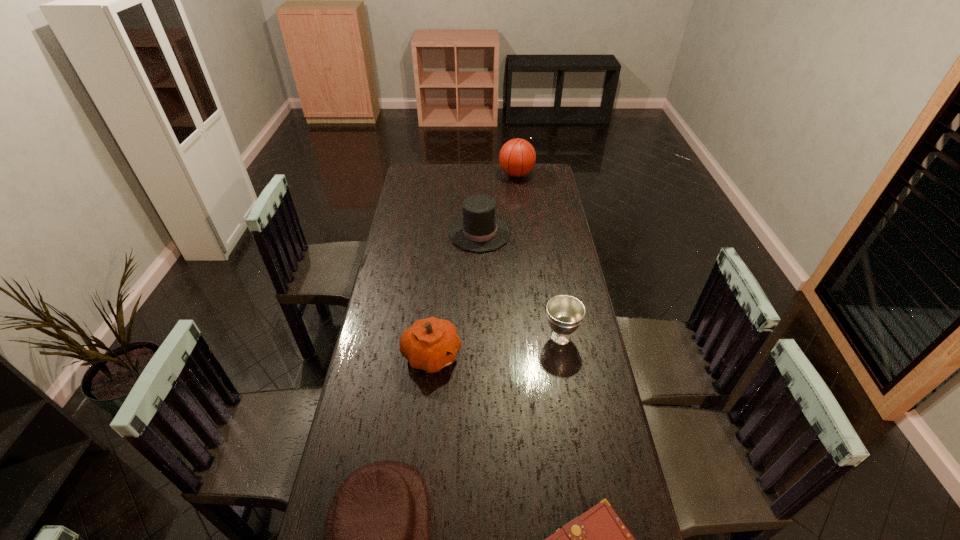
Locate an element on the screen. This screenshot has height=540, width=960. basketball is located at coordinates (517, 157).

I want to click on the farthest object, so click(x=517, y=157).

This screenshot has width=960, height=540. Find the location of `the fifth nearest object`. the fifth nearest object is located at coordinates (479, 230).

Where is `the farther hat`? The height and width of the screenshot is (540, 960). the farther hat is located at coordinates (479, 230).

Find the location of a particular element. Image resolution: width=960 pixels, height=540 pixels. pumpkin is located at coordinates (430, 344).

This screenshot has width=960, height=540. I want to click on chalice, so click(565, 313).

Locate an element on the screen. The width and height of the screenshot is (960, 540). vacant space located 0.390m on the left of the tallest object is located at coordinates (425, 174).

This screenshot has height=540, width=960. I want to click on blank space located on the front of the taller hat with the decoration, so click(x=524, y=234).

Identify the location of blank area located 0.320m on the front-facing side of the pumpkin. (557, 355).

The width and height of the screenshot is (960, 540). I want to click on free point located 0.210m on the front of the chalice, so click(572, 407).